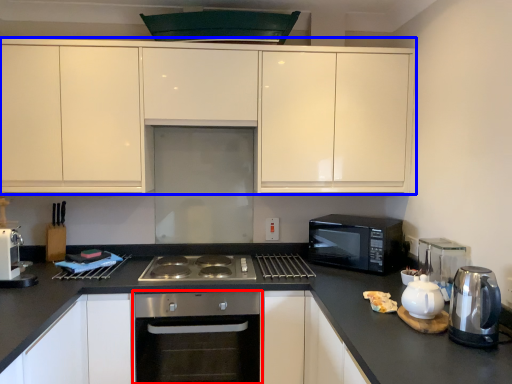
Question: Which point is closer to the camera, oven (highlighted by a red box) or cabinetry (highlighted by a blue box)?

Choices:
 (A) oven
 (B) cabinetry

Answer: (A)